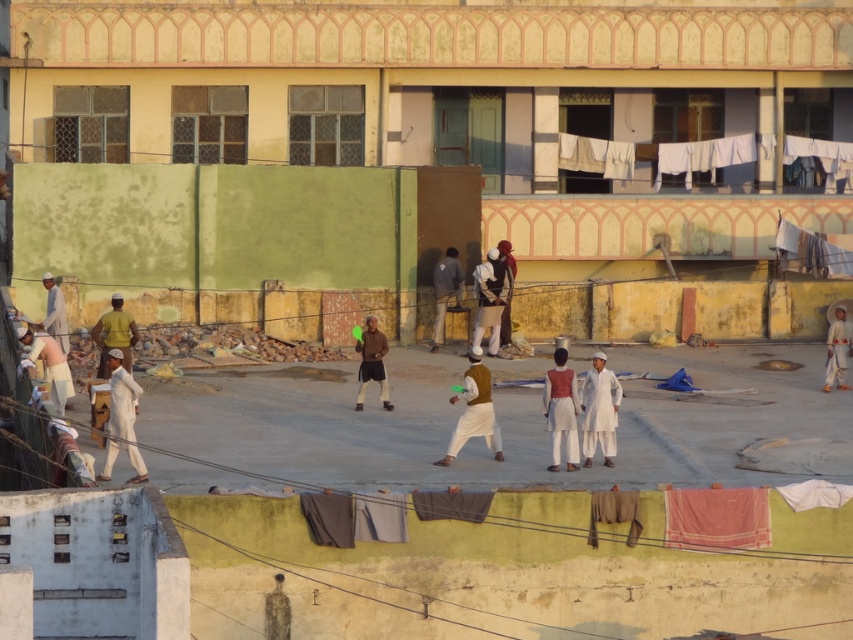
You are standing on the rooftop and want to hang your brown leather jacket at center on the light beige fabric at lower left. Is there enough space to place the jacket without overlapping anything?

The light beige fabric at lower left is positioned under the brown leather jacket at center, so placing the jacket there would cause overlapping. Choose another location.

You are standing on the rooftop and want to retrieve your jacket from the clothesline. You see both the brown matte jacket at center and the brown leather jacket at center. Which one is closer to you?

The brown matte jacket at center is positioned under the brown leather jacket at center, so the brown matte jacket at center is closer to you.

You are a delivery person trying to distinguish between two jackets on a rooftop. You see a brown matte jacket at center and a brown leather jacket at center. Which jacket is bigger?

The brown matte jacket at center has a larger size compared to the brown leather jacket at center.